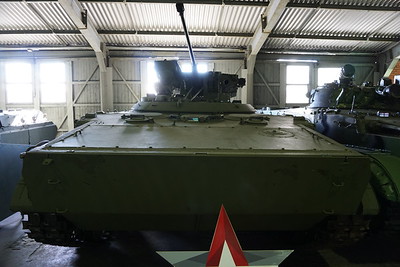
Where is `window pane`? The height and width of the screenshot is (267, 400). window pane is located at coordinates 17,75, 50,75, 50,92, 14,96, 297,70, 296,96, 332,66, 152,67, 149,90, 187,67.